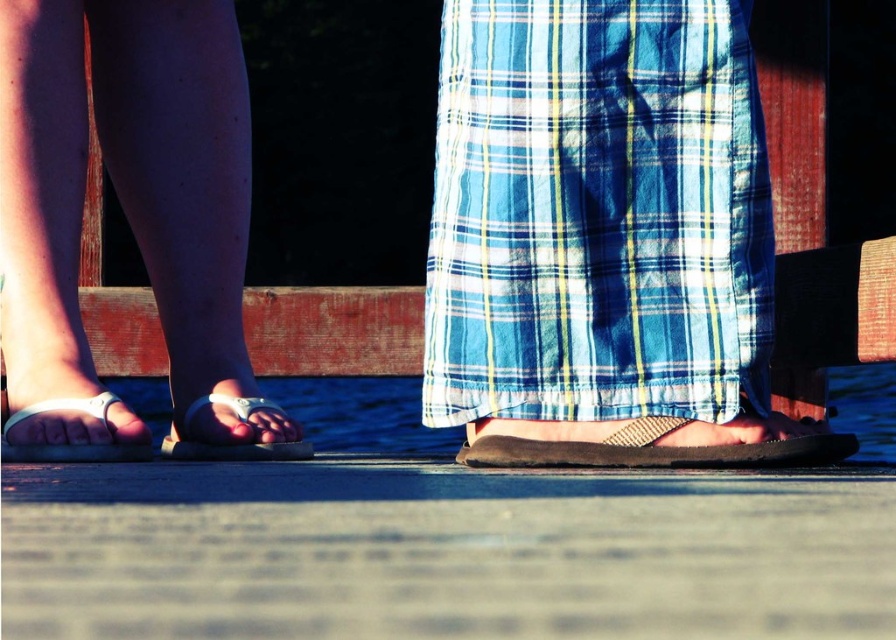
You are a photographer trying to capture the two points in the image. Which point, point (734,291) or point (128,100), appears closer to your camera lens?

Point (734,291) is closer to the camera than point (128,100).